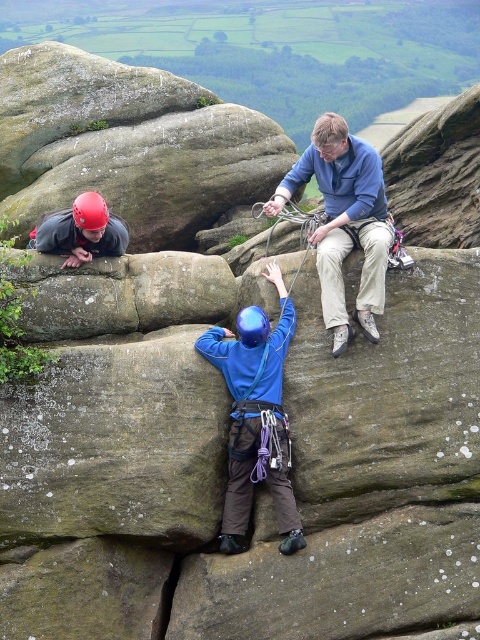
Question: Can you confirm if blue fabric helmet at center is positioned to the left of matte red helmet at upper left?

Choices:
 (A) no
 (B) yes

Answer: (A)

Question: Which of the following is the farthest from the observer?

Choices:
 (A) (254, 358)
 (B) (58, 234)

Answer: (B)

Question: Which point is farther from the camera taking this photo?

Choices:
 (A) (238, 403)
 (B) (101, 211)

Answer: (B)

Question: Where is blue fabric helmet at center located in relation to matte red helmet at upper left in the image?

Choices:
 (A) left
 (B) right

Answer: (B)

Question: Does blue fabric helmet at center have a smaller size compared to matte red helmet at upper left?

Choices:
 (A) yes
 (B) no

Answer: (A)